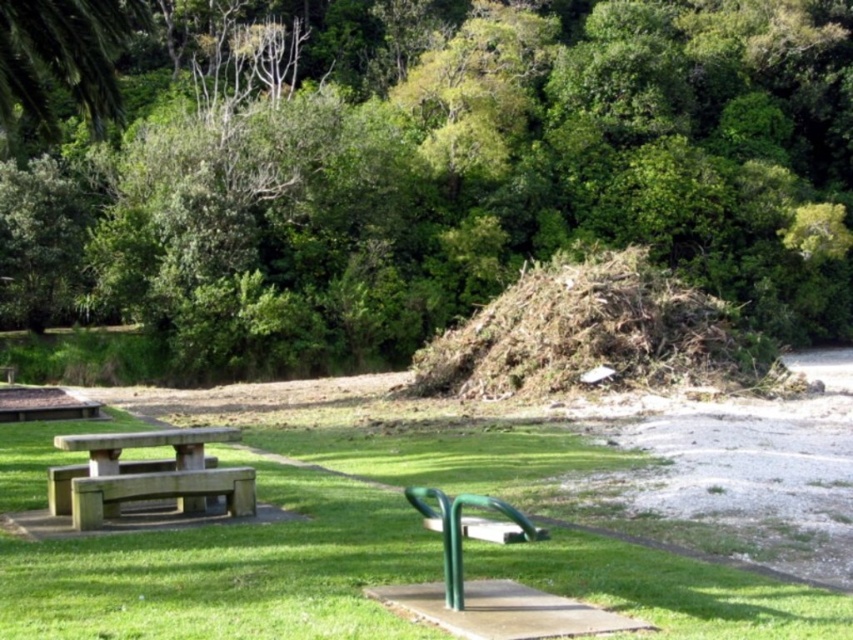
You are a gardener who needs to place a new flower pot between the green grassy at center and the green matte park bench at center. According to the scene description, which object should the flower pot be placed closer to?

The flower pot should be placed closer to the green grassy at center because it is located below the green matte park bench at center, meaning the grass is lower in position and the bench is above it.